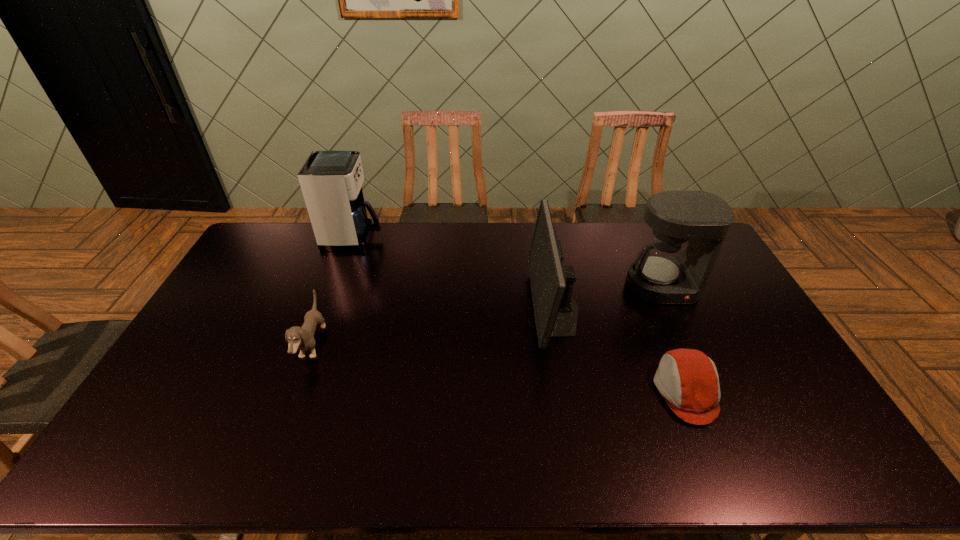
What are the coordinates of `free location located on the screen side of the computer monitor` in the screenshot? It's located at (508, 308).

You are a GUI agent. You are given a task and a screenshot of the screen. Output one action in this format:
    pyautogui.click(x=<x>, y=<y>)
    Task: Click on the free region located at the face of the puppy
    The width and height of the screenshot is (960, 540).
    Given the screenshot: What is the action you would take?
    pyautogui.click(x=445, y=345)

Identify the location of free location located on the front-facing side of the shortest object. This screenshot has width=960, height=540. (509, 392).

I want to click on free spot located 0.240m on the front-facing side of the shortest object, so coord(567,392).

Identify the location of free space located 0.240m on the front-facing side of the shortest object. This screenshot has width=960, height=540. (567, 392).

The height and width of the screenshot is (540, 960). I want to click on object that is at the far edge, so click(331, 182).

Find the location of a particular element. object located at the right edge is located at coordinates (665, 274).

The width and height of the screenshot is (960, 540). I want to click on free region at the far edge of the desktop, so click(x=492, y=253).

At what (x,y) coordinates should I click in order to perform the action: click on free space at the near edge of the desktop. Please return your answer as a coordinate pair (x, y). The height and width of the screenshot is (540, 960). Looking at the image, I should click on (283, 455).

Where is `vacant space at the left edge`? The image size is (960, 540). vacant space at the left edge is located at coordinates (232, 285).